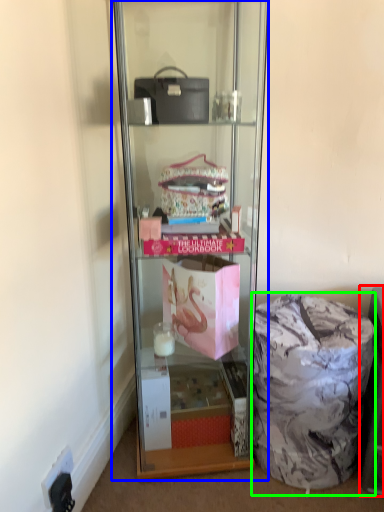
Question: Which object is positioned farthest from cabinet (highlighted by a red box)? Select from shelf (highlighted by a blue box) and garbage (highlighted by a green box).

Choices:
 (A) shelf
 (B) garbage

Answer: (A)